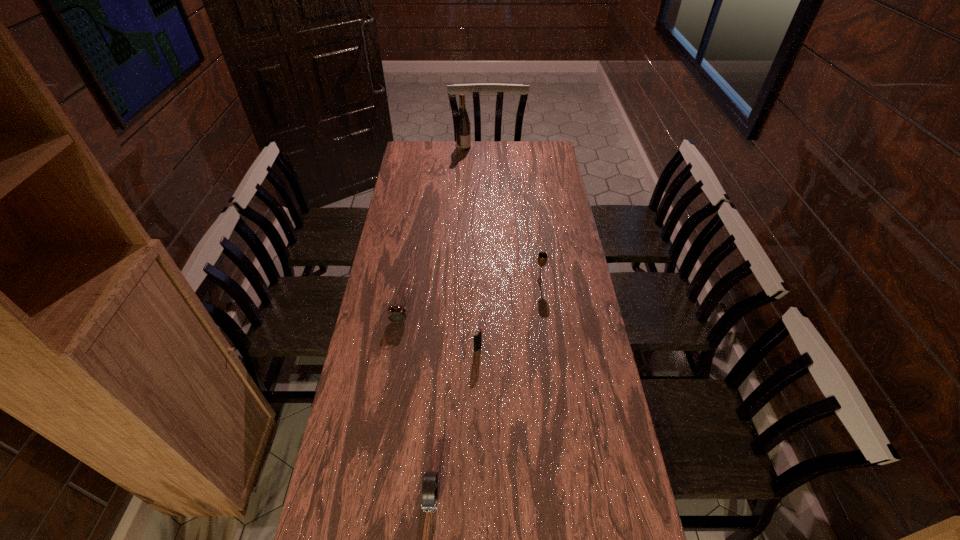
Where is `vacant space located on the front of the chalice`? vacant space located on the front of the chalice is located at coordinates 545,327.

Locate an element on the screen. free spot located on the right of the igniter is located at coordinates tap(534, 349).

Find the location of `blank space located on the face of the alarm clock`. blank space located on the face of the alarm clock is located at coordinates (393, 362).

You are a GUI agent. You are given a task and a screenshot of the screen. Output one action in this format:
    pyautogui.click(x=<x>, y=<y>)
    Task: Click on the object located in the far edge section of the desktop
    The height and width of the screenshot is (540, 960).
    Given the screenshot: What is the action you would take?
    pyautogui.click(x=463, y=132)

Where is `object located at the left edge`? Image resolution: width=960 pixels, height=540 pixels. object located at the left edge is located at coordinates (396, 314).

At what (x,y) coordinates should I click in order to perform the action: click on object that is at the right edge. Please return your answer as a coordinate pair (x, y). The width and height of the screenshot is (960, 540). Looking at the image, I should click on (542, 258).

I want to click on vacant space at the far edge, so click(499, 142).

At what (x,y) coordinates should I click in order to perform the action: click on free location at the left edge. Please return your answer as a coordinate pair (x, y). The image size is (960, 540). Looking at the image, I should click on pyautogui.click(x=394, y=200).

Find the location of a particular element. The height and width of the screenshot is (540, 960). free space at the right edge is located at coordinates (555, 274).

Image resolution: width=960 pixels, height=540 pixels. In order to click on free space at the far right corner of the desktop in this screenshot , I will do `click(526, 151)`.